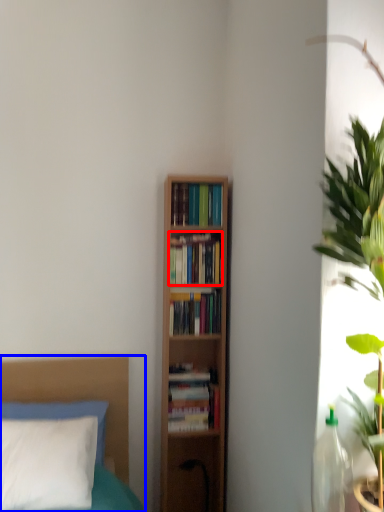
Question: Which of the following is the closest to the observer, book (highlighted by a red box) or bed (highlighted by a blue box)?

Choices:
 (A) book
 (B) bed

Answer: (B)